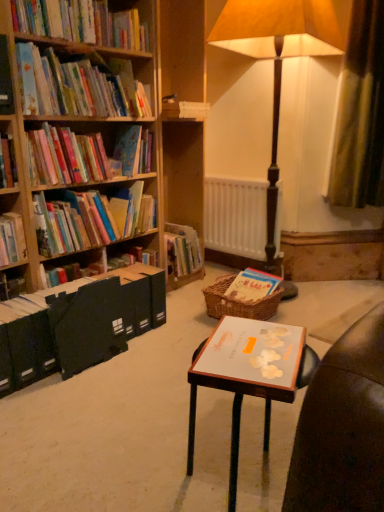
Where is `matte cardboard basket at center, marked as the fifth book in a top-to-bottom arrangement`? This screenshot has width=384, height=512. matte cardboard basket at center, marked as the fifth book in a top-to-bottom arrangement is located at coordinates (252, 286).

This screenshot has width=384, height=512. What do you see at coordinates (78, 85) in the screenshot? I see `matte paper bookshelf at upper left, the 4th book from the bottom` at bounding box center [78, 85].

This screenshot has height=512, width=384. Identify the location of white matte book at center, the 1th paperback book from the front. (253, 353).

This screenshot has width=384, height=512. What do you see at coordinates (278, 58) in the screenshot?
I see `wooden floor lamp at center` at bounding box center [278, 58].

The width and height of the screenshot is (384, 512). Find the location of `white matte radiator at center`. white matte radiator at center is located at coordinates (235, 216).

Is matte paper book at left, which is the third book from top to bottom, inside or outside of white matte radiator at center?

matte paper book at left, which is the third book from top to bottom, is not inside white matte radiator at center, it's outside.

Considering the relative sizes of matte paper book at left, which is the third book from top to bottom, and white matte radiator at center in the image provided, is matte paper book at left, which is the third book from top to bottom, smaller than white matte radiator at center?

Incorrect, matte paper book at left, which is the third book from top to bottom, is not smaller in size than white matte radiator at center.

From the image's perspective, between matte paper book at left, which is the third book from top to bottom, and white matte radiator at center, which one is located above?

matte paper book at left, which is the third book from top to bottom, appears higher in the image.

Considering the positions of objects matte paper book at left, the third book when ordered from bottom to top, and white matte radiator at center in the image provided, who is more to the right, matte paper book at left, the third book when ordered from bottom to top, or white matte radiator at center?

white matte radiator at center.

Which of these two, matte paper bookshelf at upper left, the 4th book from the bottom, or matte wooden bookshelf at left, which appears as the second book when ordered from the bottom, stands taller?

matte wooden bookshelf at left, which appears as the second book when ordered from the bottom.

Which of these two, matte paper bookshelf at upper left, the 4th book from the bottom, or matte wooden bookshelf at left, which is the fourth book from top to bottom, is wider?

matte paper bookshelf at upper left, the 4th book from the bottom.

Is matte paper bookshelf at upper left, the 4th book from the bottom, outside of matte wooden bookshelf at left, which appears as the second book when ordered from the bottom?

Yes, matte paper bookshelf at upper left, the 4th book from the bottom, is not within matte wooden bookshelf at left, which appears as the second book when ordered from the bottom.

How much distance is there between matte paper bookshelf at upper left, the 4th book from the bottom, and matte wooden bookshelf at left, which appears as the second book when ordered from the bottom?

They are 19.53 inches apart.

Is matte paper bookshelf at upper left, which is counted as the 2th book, starting from the top, closer to camera compared to hardcover books at upper left, acting as the 5th book starting from the bottom?

No, the depth of matte paper bookshelf at upper left, which is counted as the 2th book, starting from the top, is greater than that of hardcover books at upper left, acting as the 5th book starting from the bottom.

Locate an element on the screen. book above the matte paper bookshelf at upper left, the 4th book from the bottom (from a real-world perspective) is located at coordinates (81, 22).

Considering the relative sizes of matte paper bookshelf at upper left, the 4th book from the bottom, and hardcover books at upper left, acting as the 5th book starting from the bottom, in the image provided, is matte paper bookshelf at upper left, the 4th book from the bottom, smaller than hardcover books at upper left, acting as the 5th book starting from the bottom,?

No.

Considering the points (131, 108) and (61, 19), which point is behind, point (131, 108) or point (61, 19)?

Point (131, 108)

What's the angular difference between matte cardboard basket at center, which is counted as the 1th book, starting from the bottom, and wooden floor lamp at center's facing directions?

There is a 5.47-degree angle between the facing directions of matte cardboard basket at center, which is counted as the 1th book, starting from the bottom, and wooden floor lamp at center.

Considering the relative positions of matte cardboard basket at center, which is counted as the 1th book, starting from the bottom, and wooden floor lamp at center in the image provided, is matte cardboard basket at center, which is counted as the 1th book, starting from the bottom, to the right of wooden floor lamp at center from the viewer's perspective?

No.

Based on the photo, can you confirm if matte cardboard basket at center, which is counted as the 1th book, starting from the bottom, is shorter than wooden floor lamp at center?

Yes, matte cardboard basket at center, which is counted as the 1th book, starting from the bottom, is shorter than wooden floor lamp at center.

Which of these two, matte cardboard basket at center, which is counted as the 1th book, starting from the bottom, or matte wooden bookshelf at left, which appears as the second book when ordered from the bottom, is bigger?

matte wooden bookshelf at left, which appears as the second book when ordered from the bottom.

Could you tell me if matte cardboard basket at center, marked as the fifth book in a top-to-bottom arrangement, is facing matte wooden bookshelf at left, which is the fourth book from top to bottom?

No, matte cardboard basket at center, marked as the fifth book in a top-to-bottom arrangement, does not turn towards matte wooden bookshelf at left, which is the fourth book from top to bottom.

Is matte cardboard basket at center, marked as the fifth book in a top-to-bottom arrangement, in front of or behind matte wooden bookshelf at left, which is the fourth book from top to bottom, in the image?

matte cardboard basket at center, marked as the fifth book in a top-to-bottom arrangement, is positioned farther from the viewer than matte wooden bookshelf at left, which is the fourth book from top to bottom.

What's the angular difference between wooden floor lamp at center and white matte book at center, which appears as the second paperback book when viewed from the back,'s facing directions?

They differ by 20.8 degrees in their facing directions.

Which of these two, wooden floor lamp at center or white matte book at center, the 1th paperback book from the front, stands taller?

With more height is wooden floor lamp at center.

At what (x,y) coordinates should I click in order to perform the action: click on lamp behind the white matte book at center, which is the second paperback book in left-to-right order. Please return your answer as a coordinate pair (x, y). Looking at the image, I should click on (278, 58).

From a real-world perspective, is brown woven picnic basket at center above or below hardcover books at upper left, positioned as the first book in top-to-bottom order?

Clearly, from a real-world perspective, brown woven picnic basket at center is below hardcover books at upper left, positioned as the first book in top-to-bottom order.

Between brown woven picnic basket at center and hardcover books at upper left, acting as the 5th book starting from the bottom, which one has more height?

hardcover books at upper left, acting as the 5th book starting from the bottom.

Which is more to the left, brown woven picnic basket at center or hardcover books at upper left, acting as the 5th book starting from the bottom?

hardcover books at upper left, acting as the 5th book starting from the bottom.

At what (x,y) coordinates should I click in order to perform the action: click on radiator located behind the matte paper book at left, which is the third book from top to bottom. Please return your answer as a coordinate pair (x, y). This screenshot has width=384, height=512. Looking at the image, I should click on (235, 216).

Which book is the 1st one when counting from the left side of the matte paper bookshelf at upper left, the 4th book from the bottom? Please provide its 2D coordinates.

[(90, 218)]

Considering their positions, is white matte book at center, which appears as the second paperback book when viewed from the back, positioned further to white matte radiator at center than wooden floor lamp at center?

white matte book at center, which appears as the second paperback book when viewed from the back, is further to white matte radiator at center.

When comparing their distances from matte cardboard basket at center, which is counted as the 1th book, starting from the bottom, does white matte radiator at center or matte paper bookshelf at upper left, which is counted as the 2th book, starting from the top, seem closer?

Based on the image, white matte radiator at center appears to be nearer to matte cardboard basket at center, which is counted as the 1th book, starting from the bottom.

From the image, which object appears to be farther from hardcover books at upper left, positioned as the first book in top-to-bottom order, matte cardboard basket at center, marked as the fifth book in a top-to-bottom arrangement, or wooden floor lamp at center?

Based on the image, matte cardboard basket at center, marked as the fifth book in a top-to-bottom arrangement, appears to be further to hardcover books at upper left, positioned as the first book in top-to-bottom order.

Which object lies nearer to the anchor point brown woven picnic basket at center, white matte radiator at center or matte cardboard basket at center, which is counted as the 1th book, starting from the bottom?

matte cardboard basket at center, which is counted as the 1th book, starting from the bottom, is closer to brown woven picnic basket at center.

When comparing their distances from brown woven picnic basket at center, does black matte file at left, marked as the second paperback book in a front-to-back arrangement, or wooden floor lamp at center seem closer?

Based on the image, black matte file at left, marked as the second paperback book in a front-to-back arrangement, appears to be nearer to brown woven picnic basket at center.

From the image, which object appears to be farther from black matte file at left, the second paperback book when ordered from right to left, white matte radiator at center or white matte book at center, the 1th paperback book from the front?

The object further to black matte file at left, the second paperback book when ordered from right to left, is white matte radiator at center.

Looking at the image, which one is located closer to matte cardboard basket at center, which is counted as the 1th book, starting from the bottom, brown woven picnic basket at center or white matte book at center, the 1th paperback book from the front?

Based on the image, brown woven picnic basket at center appears to be nearer to matte cardboard basket at center, which is counted as the 1th book, starting from the bottom.

Considering their positions, is black matte file at left, which is counted as the first paperback book, starting from the left, positioned further to matte paper book at left, the third book when ordered from bottom to top, than matte cardboard basket at center, which is counted as the 1th book, starting from the bottom?

The object further to matte paper book at left, the third book when ordered from bottom to top, is matte cardboard basket at center, which is counted as the 1th book, starting from the bottom.

Where is `radiator between wooden floor lamp at center and brown woven picnic basket at center vertically`? radiator between wooden floor lamp at center and brown woven picnic basket at center vertically is located at coordinates (235, 216).

Locate an element on the screen. book between matte paper bookshelf at upper left, the 4th book from the bottom, and matte wooden bookshelf at left, which appears as the second book when ordered from the bottom, vertically is located at coordinates (86, 155).

Where is `picnic basket between matte paper book at left, which is the third book from top to bottom, and white matte radiator at center, in the horizontal direction`? This screenshot has height=512, width=384. picnic basket between matte paper book at left, which is the third book from top to bottom, and white matte radiator at center, in the horizontal direction is located at coordinates (238, 302).

Locate an element on the screen. This screenshot has height=512, width=384. radiator that lies between matte paper bookshelf at upper left, the 4th book from the bottom, and brown woven picnic basket at center from top to bottom is located at coordinates (235, 216).